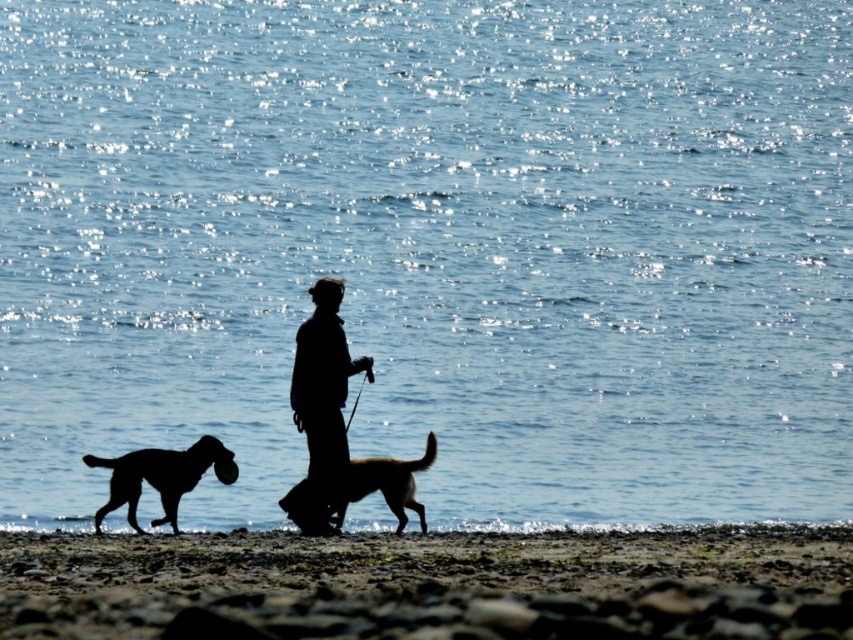
Based on the scene description, where is the rough sand beach at lower center located in the image?

The rough sand beach at lower center is located at the 2D coordinates point of (428,584).

You are a photographer trying to capture a photo of the brown fur dog at center from the rough sand beach at lower center. Considering their relative heights, will you need to adjust your camera angle upwards or downwards to get the dog in focus?

The rough sand beach at lower center is not as tall as brown fur dog at center, so you will need to adjust your camera angle upwards to get the dog in focus.